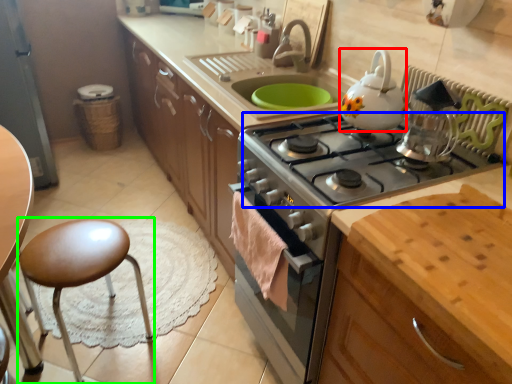
Question: Which is nearer to the kitchen appliance (highlighted by a red box)? gas stove (highlighted by a blue box) or stool (highlighted by a green box).

Choices:
 (A) gas stove
 (B) stool

Answer: (A)